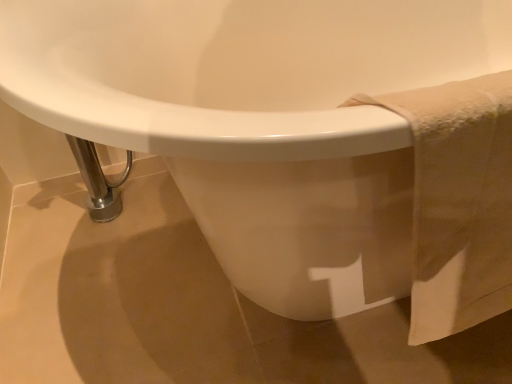
You are a GUI agent. You are given a task and a screenshot of the screen. Output one action in this format:
    pyautogui.click(x=<x>, y=<y>)
    Task: Click on the beige textured towel at right
    
    Given the screenshot: What is the action you would take?
    pyautogui.click(x=458, y=201)

The width and height of the screenshot is (512, 384). What do you see at coordinates (458, 201) in the screenshot?
I see `beige textured towel at right` at bounding box center [458, 201].

Identify the location of beige textured towel at right. (458, 201).